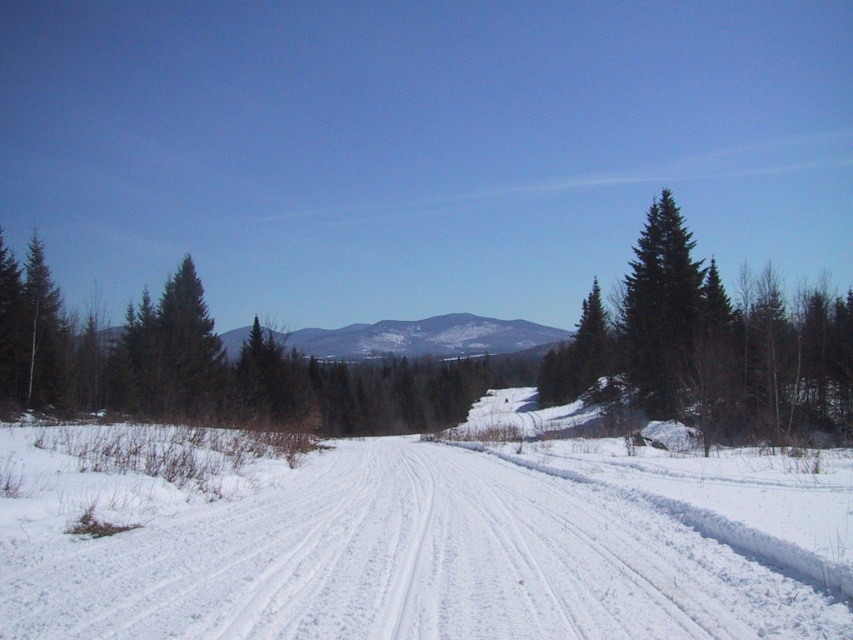
I want to click on green matte tree at left, so click(207, 365).

Is point (49, 285) in front of point (747, 419)?

No, it is not.

At what (x,y) coordinates should I click in order to perform the action: click on green matte tree at left. Please return your answer as a coordinate pair (x, y). The image size is (853, 640). Looking at the image, I should click on (207, 365).

Who is higher up, green matte tree at left or green matte tree at center?

Positioned higher is green matte tree at center.

Can you confirm if green matte tree at left is positioned to the left of green matte tree at center?

Indeed, green matte tree at left is positioned on the left side of green matte tree at center.

Locate an element on the screen. The image size is (853, 640). green matte tree at left is located at coordinates (207, 365).

Can you confirm if green needle-like tree at right is shorter than green matte tree at center?

Yes, green needle-like tree at right is shorter than green matte tree at center.

Between point (582, 378) and point (566, 388), which one is positioned behind?

Positioned behind is point (566, 388).

Where is `green needle-like tree at right`? This screenshot has height=640, width=853. green needle-like tree at right is located at coordinates (709, 346).

I want to click on green needle-like tree at right, so click(709, 346).